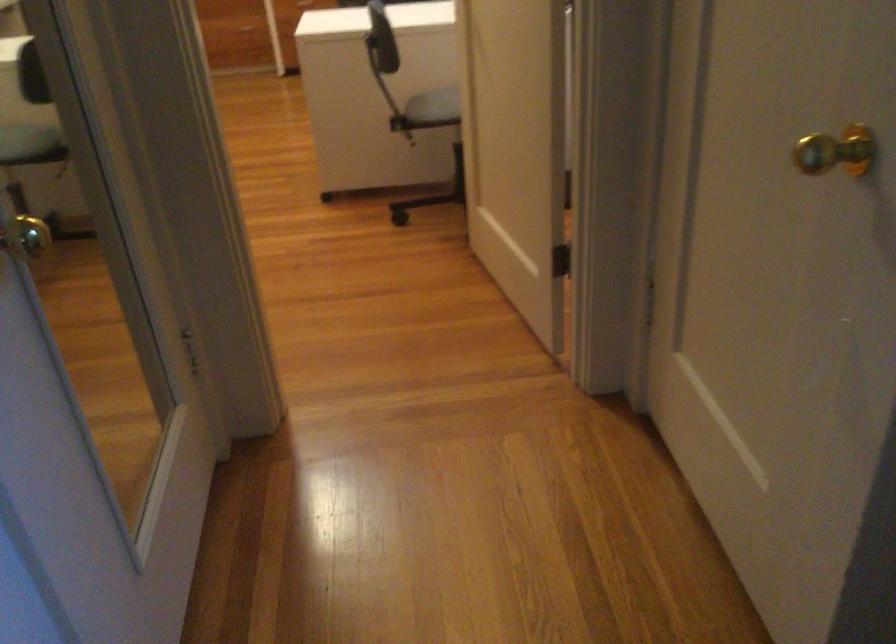
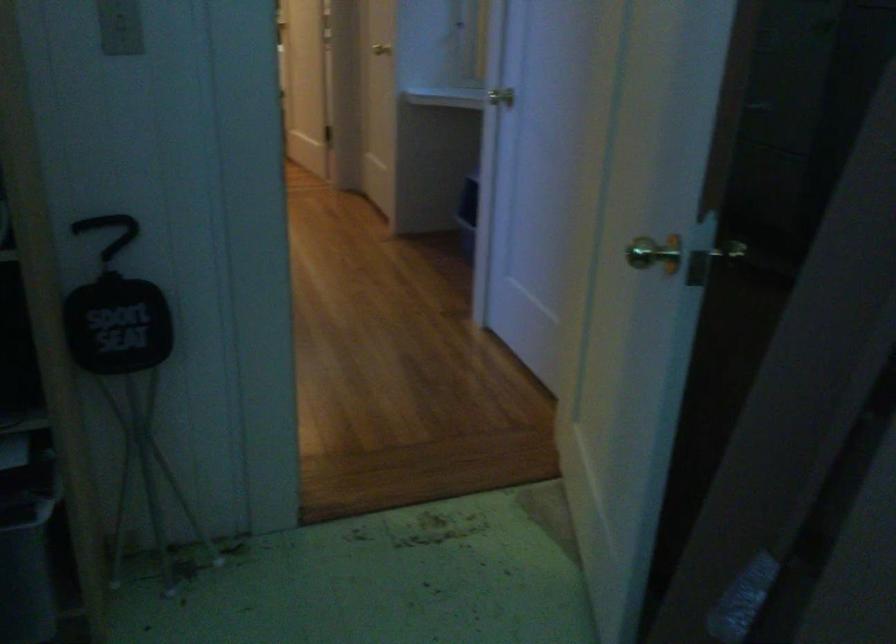
Question: I am providing you with two images of the same scene from different viewpoints. Which of the following objects are not visible in image2?

Choices:
 (A) seat handle
 (B) chair sitting surface
 (C) red canister
 (D) light switch

Answer: (B)